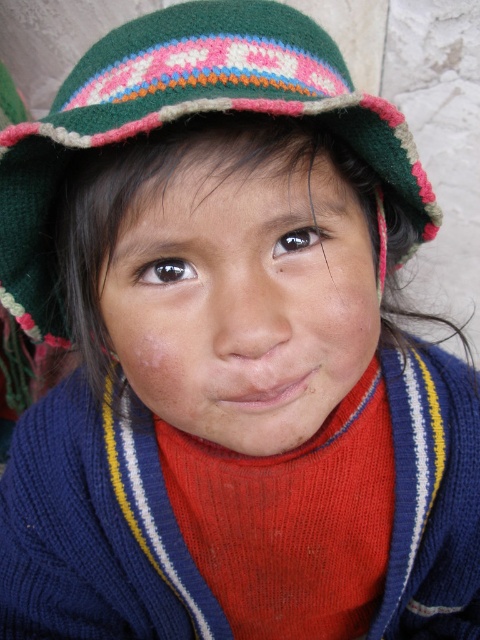
Which is in front, point (190, 403) or point (184, 67)?

Positioned in front is point (184, 67).

This screenshot has height=640, width=480. I want to click on smooth skin face at center, so [x=242, y=292].

What are the coordinates of `smooth skin face at center` in the screenshot? It's located at (242, 292).